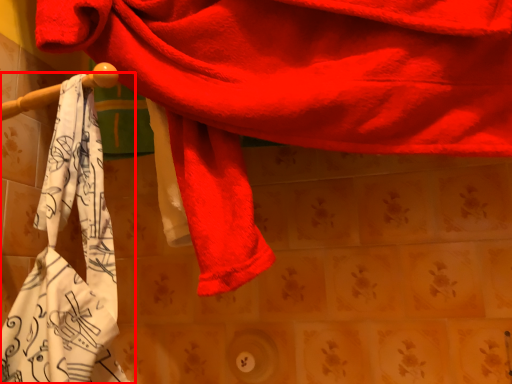
Question: Where is towel (annotated by the red box) located in relation to towel in the image?

Choices:
 (A) right
 (B) left

Answer: (B)